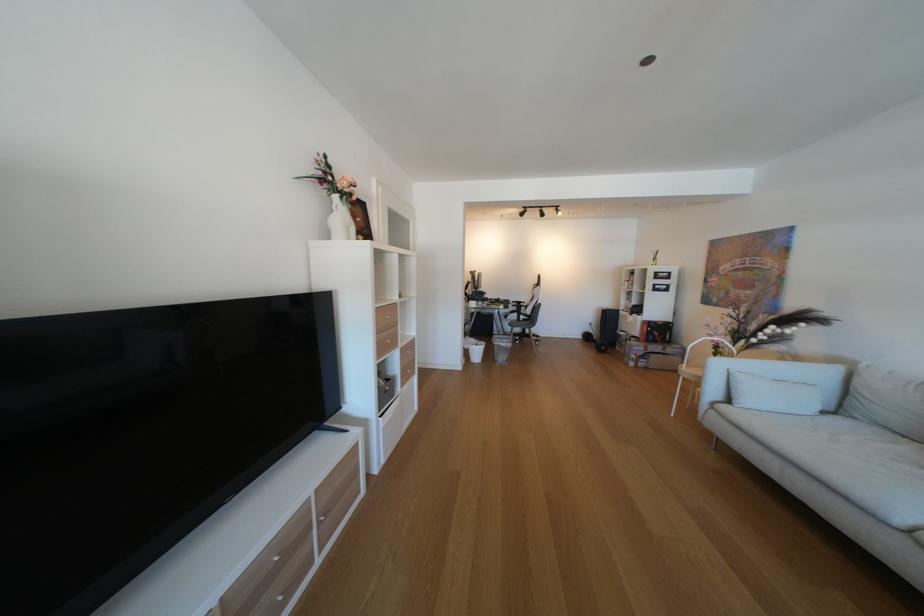
Locate an element on the screen. This screenshot has height=616, width=924. chair sitting surface is located at coordinates (524, 330).